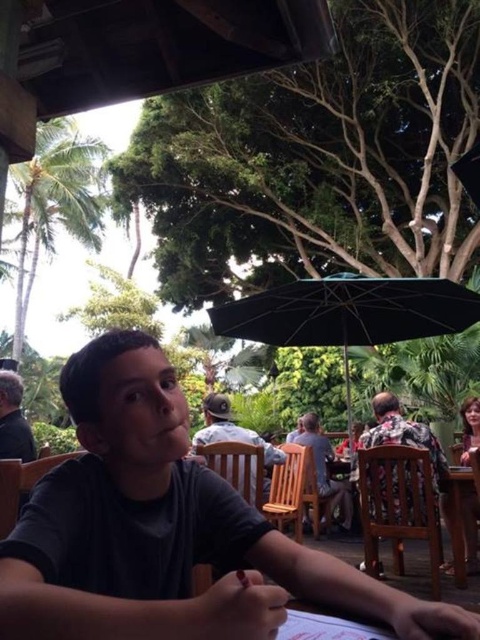
You are standing in the outdoor dining area and want to place a new table exactly at the point marked as point (455, 573). The table you want to place is 1.5 meters wide. Is there enough space around this point to fit the table without overlapping any existing tables or obstacles?

The point (455, 573) is 3.40 meters from the viewer. However, the description does not provide information about the distance between existing tables or obstacles around this point, so it is unclear if there is enough space to place the 1.5 meter wide table without overlapping.

You are a waiter at the outdoor dining area. You need to deliver a drink to the customer seated at the wooden table at lower right. To avoid spilling the drink, you should walk around which side of the dark gray shirt at left?

The wooden table at lower right is located below the dark gray shirt at left, so you should walk around the right side of the dark gray shirt at left to reach the wooden table at lower right safely without passing directly in front of the customer.